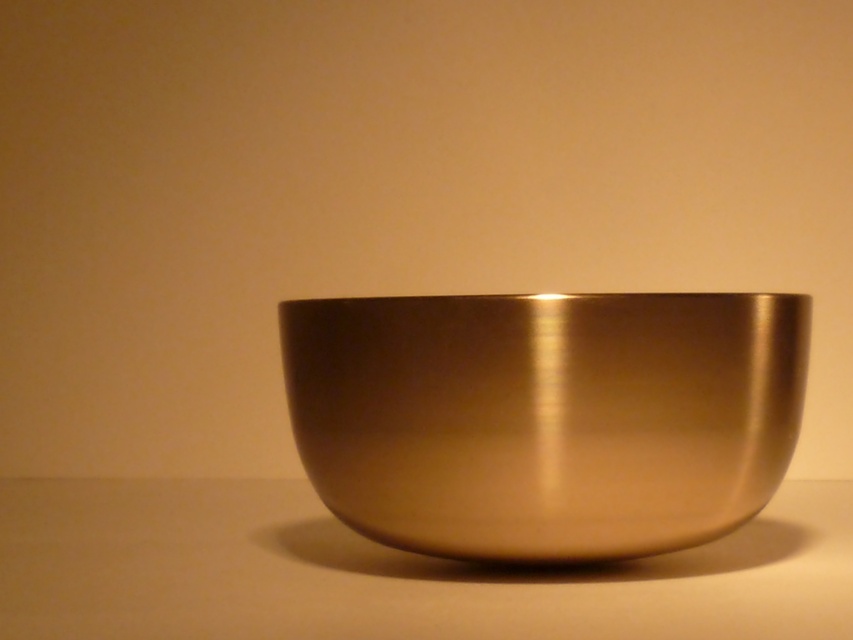
Question: Does gold metallic bowl at center have a greater width compared to metallic gold bowl at center?

Choices:
 (A) no
 (B) yes

Answer: (A)

Question: Among these points, which one is farthest from the camera?

Choices:
 (A) (769, 364)
 (B) (119, 515)

Answer: (B)

Question: Among these points, which one is nearest to the camera?

Choices:
 (A) (465, 476)
 (B) (608, 618)

Answer: (B)

Question: Does gold metallic bowl at center appear on the right side of metallic gold bowl at center?

Choices:
 (A) yes
 (B) no

Answer: (A)

Question: Is gold metallic bowl at center to the right of metallic gold bowl at center from the viewer's perspective?

Choices:
 (A) no
 (B) yes

Answer: (B)